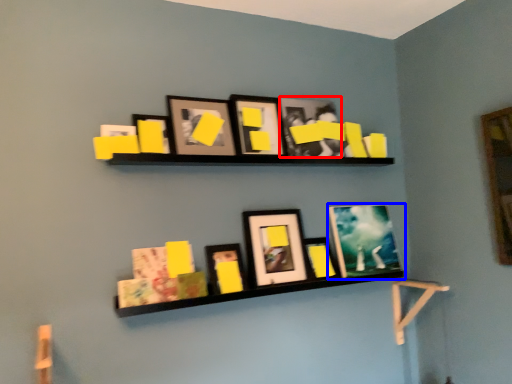
Question: Which of the following is the closest to the observer, picture frame (highlighted by a red box) or picture frame (highlighted by a blue box)?

Choices:
 (A) picture frame
 (B) picture frame

Answer: (A)